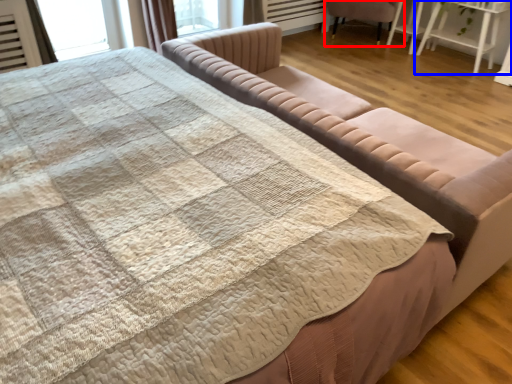
Question: Which object appears farthest to the camera in this image, chair (highlighted by a red box) or table (highlighted by a blue box)?

Choices:
 (A) chair
 (B) table

Answer: (A)